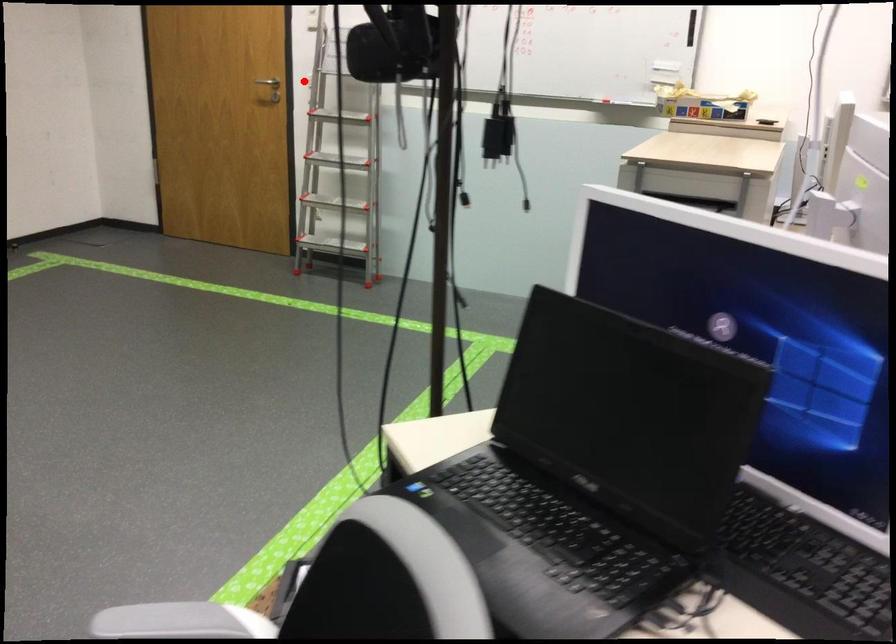
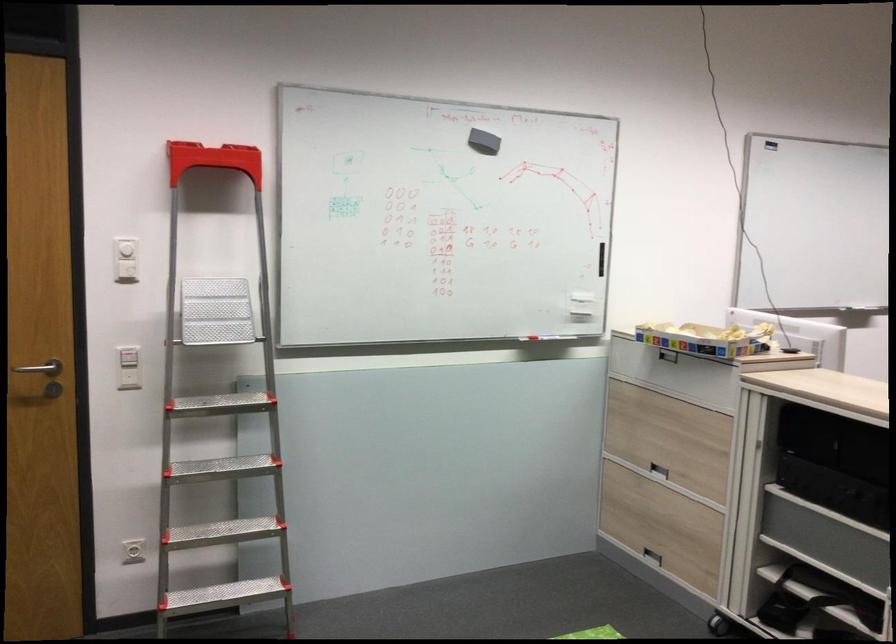
Locate, in the second image, the point that corresponds to the highlighted location in the first image.

(40, 368)